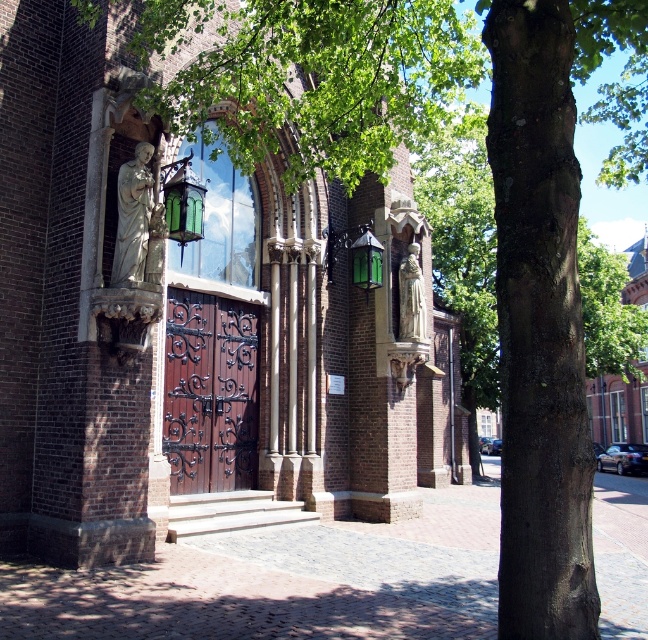
You are standing at the entrance of the church and want to walk towards the smooth wooden door at center. Which direction should you move relative to the brick pavement at center?

The brick pavement at center is positioned on the left side of the smooth wooden door at center, so to reach the door, you should move to the right from the brick pavement at center.

You are standing at the entrance of the brick church at center and want to take a photo of the dark wood wrought iron door at center. Which part of the church should you focus on to ensure the door is clearly visible in your photo?

The brick church at center is located above the dark wood wrought iron door at center, so you should focus on the lower part of the church to ensure the door is clearly visible in your photo.

Based on the photo, you are standing at the entrance of the brick church and want to open the door. There are two doors here, the dark wood wrought iron door at center and the smooth wooden door at center. Which door is closer to you?

Both doors are at the same location at center, so they are equally close to you.